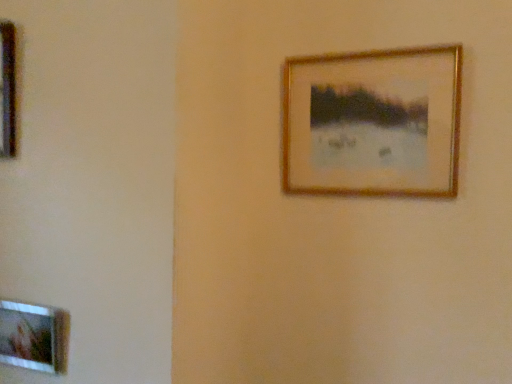
Locate an element on the screen. wooden picture frame at lower left, which ranks as the 2th picture frame in right-to-left order is located at coordinates (32, 336).

Where is `metallic gold picture frame at left, the 3th picture frame viewed from the right`? The height and width of the screenshot is (384, 512). metallic gold picture frame at left, the 3th picture frame viewed from the right is located at coordinates (7, 90).

Describe the element at coordinates (373, 123) in the screenshot. I see `gold metallic picture frame at upper right, which is the 3th picture frame in left-to-right order` at that location.

The image size is (512, 384). What are the coordinates of `wooden picture frame at lower left, marked as the second picture frame in a left-to-right arrangement` in the screenshot? It's located at [32, 336].

Does wooden picture frame at lower left, which ranks as the 2th picture frame in right-to-left order, have a greater height compared to metallic gold picture frame at left, the 3th picture frame viewed from the right?

Incorrect, the height of wooden picture frame at lower left, which ranks as the 2th picture frame in right-to-left order, is not larger of that of metallic gold picture frame at left, the 3th picture frame viewed from the right.

Is metallic gold picture frame at left, which appears as the 3th picture frame when ordered from the bottom, inside wooden picture frame at lower left, marked as the second picture frame in a left-to-right arrangement?

No, metallic gold picture frame at left, which appears as the 3th picture frame when ordered from the bottom, is not inside wooden picture frame at lower left, marked as the second picture frame in a left-to-right arrangement.

Does wooden picture frame at lower left, arranged as the third picture frame when viewed from the top, touch metallic gold picture frame at left, which is the first picture frame in left-to-right order?

They are not placed beside each other.

Identify the location of the 2nd picture frame positioned above the wooden picture frame at lower left, arranged as the third picture frame when viewed from the top (from a real-world perspective). (7, 90).

Does wooden picture frame at lower left, which ranks as the 2th picture frame in right-to-left order, have a larger size compared to gold metallic picture frame at upper right, which is the 3th picture frame in left-to-right order?

Actually, wooden picture frame at lower left, which ranks as the 2th picture frame in right-to-left order, might be smaller than gold metallic picture frame at upper right, which is the 3th picture frame in left-to-right order.

From the image's perspective, between wooden picture frame at lower left, marked as the second picture frame in a left-to-right arrangement, and gold metallic picture frame at upper right, placed as the 2th picture frame when sorted from top to bottom, who is located below?

wooden picture frame at lower left, marked as the second picture frame in a left-to-right arrangement, from the image's perspective.

Is wooden picture frame at lower left, arranged as the third picture frame when viewed from the top, located outside gold metallic picture frame at upper right, placed as the 2th picture frame when sorted from top to bottom?

Yes, wooden picture frame at lower left, arranged as the third picture frame when viewed from the top, is not within gold metallic picture frame at upper right, placed as the 2th picture frame when sorted from top to bottom.

Considering the sizes of objects wooden picture frame at lower left, marked as the second picture frame in a left-to-right arrangement, and gold metallic picture frame at upper right, placed as the 2th picture frame when sorted from top to bottom, in the image provided, who is wider, wooden picture frame at lower left, marked as the second picture frame in a left-to-right arrangement, or gold metallic picture frame at upper right, placed as the 2th picture frame when sorted from top to bottom,?

With larger width is wooden picture frame at lower left, marked as the second picture frame in a left-to-right arrangement.

The image size is (512, 384). Find the location of `the 2nd picture frame in front of the gold metallic picture frame at upper right, which appears as the first picture frame when viewed from the right, counting from the anchor's position`. the 2nd picture frame in front of the gold metallic picture frame at upper right, which appears as the first picture frame when viewed from the right, counting from the anchor's position is located at coordinates (7, 90).

Is metallic gold picture frame at left, which appears as the 3th picture frame when ordered from the bottom, positioned behind gold metallic picture frame at upper right, which is the 3th picture frame in left-to-right order?

No, metallic gold picture frame at left, which appears as the 3th picture frame when ordered from the bottom, is closer to the viewer.

Would you say metallic gold picture frame at left, arranged as the first picture frame when viewed from the top, is a long distance from gold metallic picture frame at upper right, which is the 3th picture frame in left-to-right order?

No.

Who is taller, metallic gold picture frame at left, which is the first picture frame in left-to-right order, or gold metallic picture frame at upper right, which is the 3th picture frame in left-to-right order?

With more height is gold metallic picture frame at upper right, which is the 3th picture frame in left-to-right order.

Considering the relative sizes of gold metallic picture frame at upper right, which appears as the first picture frame when viewed from the right, and wooden picture frame at lower left, arranged as the third picture frame when viewed from the top, in the image provided, is gold metallic picture frame at upper right, which appears as the first picture frame when viewed from the right, thinner than wooden picture frame at lower left, arranged as the third picture frame when viewed from the top,?

Indeed, gold metallic picture frame at upper right, which appears as the first picture frame when viewed from the right, has a lesser width compared to wooden picture frame at lower left, arranged as the third picture frame when viewed from the top.

Could you tell me if gold metallic picture frame at upper right, which is the 3th picture frame in left-to-right order, is facing wooden picture frame at lower left, marked as the second picture frame in a left-to-right arrangement?

No, gold metallic picture frame at upper right, which is the 3th picture frame in left-to-right order, is not oriented towards wooden picture frame at lower left, marked as the second picture frame in a left-to-right arrangement.

From the image's perspective, which picture frame is the 1st one above the wooden picture frame at lower left, acting as the 1th picture frame starting from the bottom? Please provide its 2D coordinates.

[(373, 123)]

Is gold metallic picture frame at upper right, which appears as the 2th picture frame when ordered from the bottom, far away from wooden picture frame at lower left, marked as the second picture frame in a left-to-right arrangement?

No, gold metallic picture frame at upper right, which appears as the 2th picture frame when ordered from the bottom, is not far from wooden picture frame at lower left, marked as the second picture frame in a left-to-right arrangement.

In terms of width, does gold metallic picture frame at upper right, which appears as the 2th picture frame when ordered from the bottom, look wider or thinner when compared to metallic gold picture frame at left, which appears as the 3th picture frame when ordered from the bottom?

Clearly, gold metallic picture frame at upper right, which appears as the 2th picture frame when ordered from the bottom, has less width compared to metallic gold picture frame at left, which appears as the 3th picture frame when ordered from the bottom.

Can you see gold metallic picture frame at upper right, placed as the 2th picture frame when sorted from top to bottom, touching metallic gold picture frame at left, which is the first picture frame in left-to-right order?

No, gold metallic picture frame at upper right, placed as the 2th picture frame when sorted from top to bottom, is not beside metallic gold picture frame at left, which is the first picture frame in left-to-right order.

From the image's perspective, does gold metallic picture frame at upper right, which appears as the first picture frame when viewed from the right, appear higher than metallic gold picture frame at left, which appears as the 3th picture frame when ordered from the bottom?

Actually, gold metallic picture frame at upper right, which appears as the first picture frame when viewed from the right, appears below metallic gold picture frame at left, which appears as the 3th picture frame when ordered from the bottom, in the image.

Is gold metallic picture frame at upper right, placed as the 2th picture frame when sorted from top to bottom, aimed at metallic gold picture frame at left, which is the first picture frame in left-to-right order?

No, gold metallic picture frame at upper right, placed as the 2th picture frame when sorted from top to bottom, is not turned towards metallic gold picture frame at left, which is the first picture frame in left-to-right order.

There is a metallic gold picture frame at left, which appears as the 3th picture frame when ordered from the bottom. At what (x,y) coordinates should I click in order to perform the action: click on the 2nd picture frame below it (from a real-world perspective). Please return your answer as a coordinate pair (x, y). Looking at the image, I should click on (32, 336).

Which of these two, metallic gold picture frame at left, the 3th picture frame viewed from the right, or wooden picture frame at lower left, which ranks as the 2th picture frame in right-to-left order, is bigger?

Bigger between the two is metallic gold picture frame at left, the 3th picture frame viewed from the right.

Is metallic gold picture frame at left, the 3th picture frame viewed from the right, aimed at wooden picture frame at lower left, marked as the second picture frame in a left-to-right arrangement?

No, metallic gold picture frame at left, the 3th picture frame viewed from the right, is not aimed at wooden picture frame at lower left, marked as the second picture frame in a left-to-right arrangement.

You are a GUI agent. You are given a task and a screenshot of the screen. Output one action in this format:
    pyautogui.click(x=<x>, y=<y>)
    Task: Click on the picture frame in front of the wooden picture frame at lower left, which ranks as the 2th picture frame in right-to-left order
    This screenshot has height=384, width=512.
    Given the screenshot: What is the action you would take?
    pyautogui.click(x=7, y=90)

Find the location of a particular element. picture frame behind the wooden picture frame at lower left, arranged as the third picture frame when viewed from the top is located at coordinates (373, 123).

When comparing their distances from gold metallic picture frame at upper right, which is the 3th picture frame in left-to-right order, does metallic gold picture frame at left, arranged as the first picture frame when viewed from the top, or wooden picture frame at lower left, marked as the second picture frame in a left-to-right arrangement, seem further?

wooden picture frame at lower left, marked as the second picture frame in a left-to-right arrangement, is further to gold metallic picture frame at upper right, which is the 3th picture frame in left-to-right order.

Looking at the image, which one is located further to wooden picture frame at lower left, marked as the second picture frame in a left-to-right arrangement, gold metallic picture frame at upper right, which is the 3th picture frame in left-to-right order, or metallic gold picture frame at left, the 3th picture frame viewed from the right?

gold metallic picture frame at upper right, which is the 3th picture frame in left-to-right order, is further to wooden picture frame at lower left, marked as the second picture frame in a left-to-right arrangement.

Which object lies further to the anchor point metallic gold picture frame at left, the 3th picture frame viewed from the right, gold metallic picture frame at upper right, which is the 3th picture frame in left-to-right order, or wooden picture frame at lower left, arranged as the third picture frame when viewed from the top?

Based on the image, gold metallic picture frame at upper right, which is the 3th picture frame in left-to-right order, appears to be further to metallic gold picture frame at left, the 3th picture frame viewed from the right.

Estimate the real-world distances between objects in this image. Which object is further from gold metallic picture frame at upper right, which is the 3th picture frame in left-to-right order, wooden picture frame at lower left, which ranks as the 2th picture frame in right-to-left order, or metallic gold picture frame at left, the 3th picture frame viewed from the right?

The object further to gold metallic picture frame at upper right, which is the 3th picture frame in left-to-right order, is wooden picture frame at lower left, which ranks as the 2th picture frame in right-to-left order.

From the image, which object appears to be farther from metallic gold picture frame at left, which is the first picture frame in left-to-right order, wooden picture frame at lower left, marked as the second picture frame in a left-to-right arrangement, or gold metallic picture frame at upper right, placed as the 2th picture frame when sorted from top to bottom?

gold metallic picture frame at upper right, placed as the 2th picture frame when sorted from top to bottom, is positioned further to the anchor metallic gold picture frame at left, which is the first picture frame in left-to-right order.

Estimate the real-world distances between objects in this image. Which object is further from wooden picture frame at lower left, acting as the 1th picture frame starting from the bottom, metallic gold picture frame at left, the 3th picture frame viewed from the right, or gold metallic picture frame at upper right, which appears as the 2th picture frame when ordered from the bottom?

Based on the image, gold metallic picture frame at upper right, which appears as the 2th picture frame when ordered from the bottom, appears to be further to wooden picture frame at lower left, acting as the 1th picture frame starting from the bottom.

Locate an element on the screen. picture frame between metallic gold picture frame at left, the 3th picture frame viewed from the right, and gold metallic picture frame at upper right, which is the 3th picture frame in left-to-right order, in the horizontal direction is located at coordinates (32, 336).